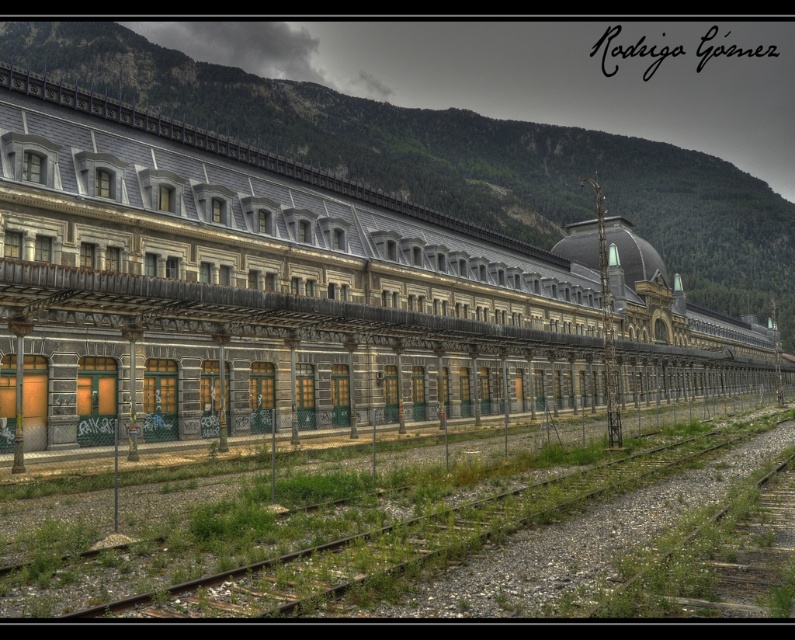
Question: Is stone train at center below gravelly metal train track at lower left?

Choices:
 (A) no
 (B) yes

Answer: (A)

Question: Which object is farther from the camera taking this photo?

Choices:
 (A) gravelly metal train track at lower left
 (B) stone train at center

Answer: (B)

Question: From the image, what is the correct spatial relationship of stone train at center in relation to gravelly metal train track at lower left?

Choices:
 (A) below
 (B) above

Answer: (B)

Question: Among these objects, which one is farthest from the camera?

Choices:
 (A) stone train at center
 (B) gravelly metal train track at lower left

Answer: (A)

Question: Is stone train at center positioned before gravelly metal train track at lower left?

Choices:
 (A) no
 (B) yes

Answer: (A)

Question: Which of the following is the closest to the observer?

Choices:
 (A) gravelly metal train track at lower left
 (B) stone train at center

Answer: (A)